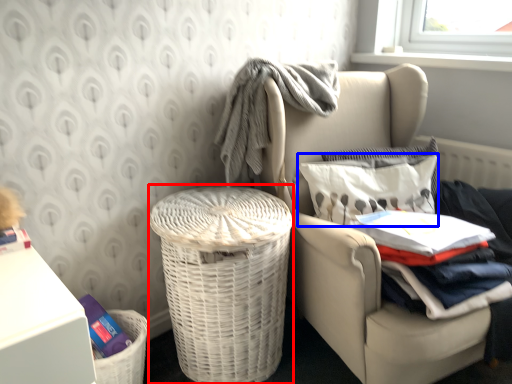
Question: Which object is closer to the camera taking this photo, shopping basket (highlighted by a red box) or pillow (highlighted by a blue box)?

Choices:
 (A) shopping basket
 (B) pillow

Answer: (A)